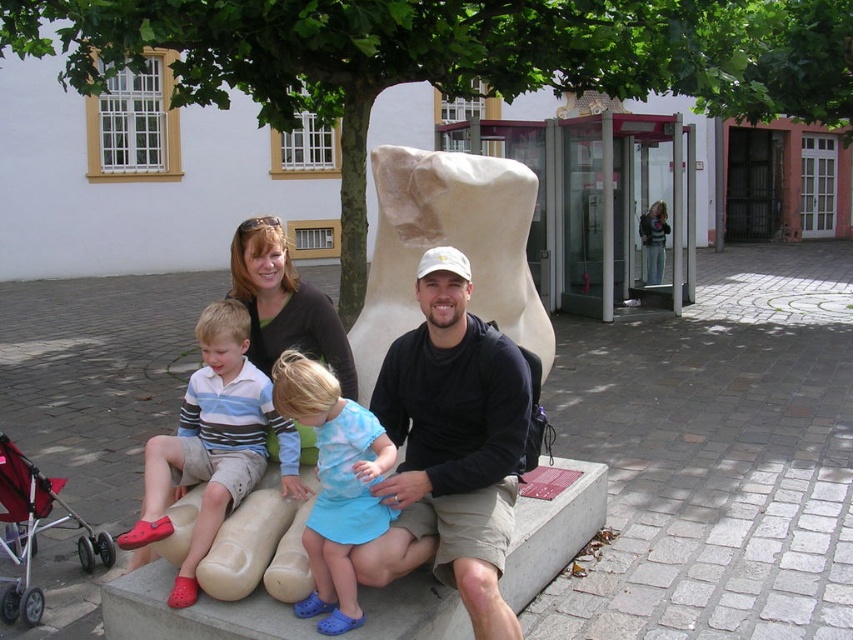
Question: Is matte black shirt at center positioned at the back of black matte shirt at center?

Choices:
 (A) no
 (B) yes

Answer: (A)

Question: Does matte black shirt at center lie in front of blue fabric dress at center?

Choices:
 (A) yes
 (B) no

Answer: (A)

Question: Which point is farther to the camera?

Choices:
 (A) black matte shirt at center
 (B) striped cotton shirt at left
 (C) red fabric stroller at lower left
 (D) blue fabric dress at center

Answer: (C)

Question: Where is striped cotton shirt at left located in relation to blue fabric dress at center in the image?

Choices:
 (A) right
 (B) left

Answer: (B)

Question: Which of the following is the closest to the observer?

Choices:
 (A) (256, 465)
 (B) (347, 84)
 (C) (312, 420)

Answer: (C)

Question: Estimate the real-world distances between objects in this image. Which object is farther from the blue fabric dress at center?

Choices:
 (A) black matte shirt at center
 (B) matte black shirt at center
 (C) green leafy tree at upper center

Answer: (C)